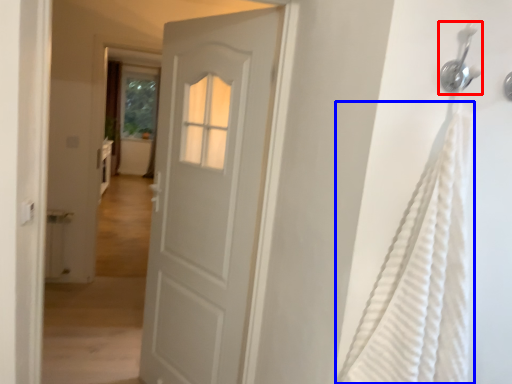
Question: Among these objects, which one is farthest to the camera, shower (highlighted by a red box) or shower curtain (highlighted by a blue box)?

Choices:
 (A) shower
 (B) shower curtain

Answer: (A)